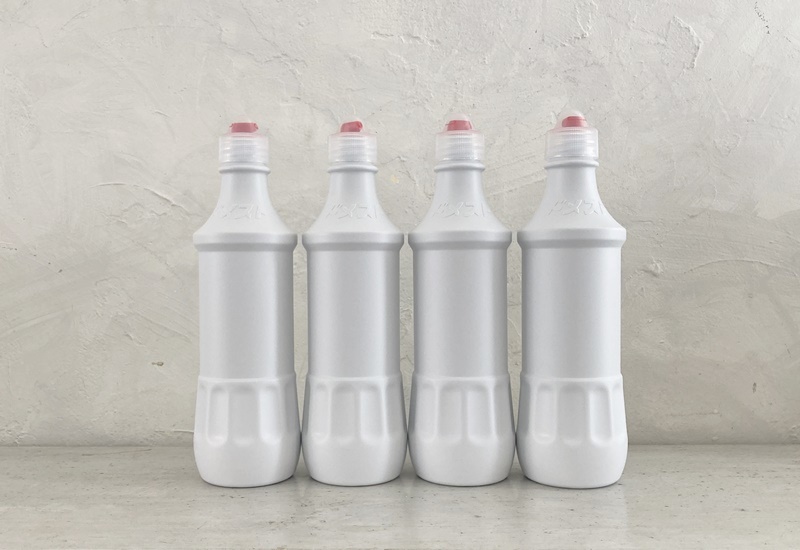
This screenshot has height=550, width=800. I want to click on 4 bottles in a row, so coord(246,403), coord(353,386), coord(454,364), coord(576,337).